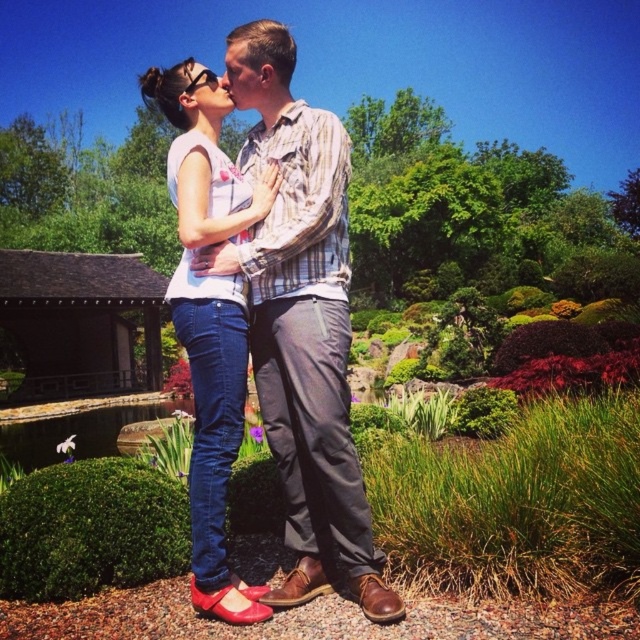
Between point (285, 61) and point (211, 428), which one is positioned in front?

Point (211, 428)

Is point (300, 193) closer to viewer compared to point (193, 298)?

No, (300, 193) is further to viewer.

Locate an element on the screen. brown leather shoes at center is located at coordinates (301, 324).